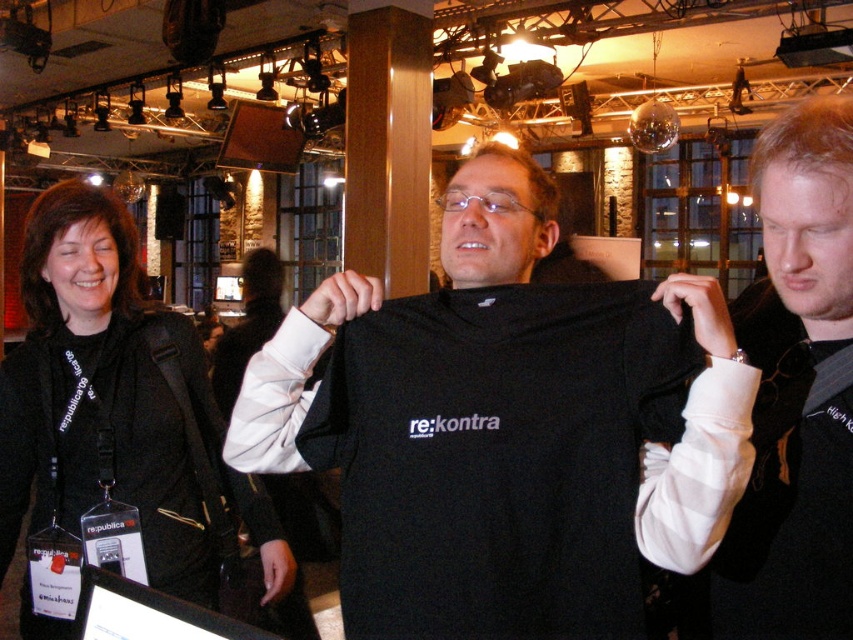
You are standing in the large hall and want to move from point (218, 556) to point (831, 448). Is the destination point in front of or behind you?

The destination point (831, 448) is in front of you because point (218, 556) is behind point (831, 448).

You are standing in the conference hall and want to determine which of the two points, point (680, 392) or point (776, 296), is nearer to you. Based on the scene description, which point is closer?

Point (680, 392) is closer to the viewer than point (776, 296).